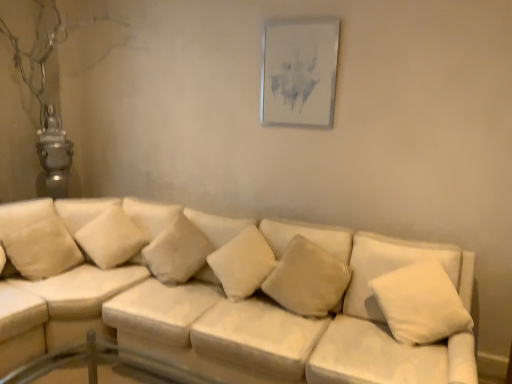
This screenshot has width=512, height=384. What are the coordinates of `white soft pillow at right, marked as the sixth pillow in a left-to-right arrangement` in the screenshot? It's located at (420, 303).

Describe the element at coordinates (37, 239) in the screenshot. The width and height of the screenshot is (512, 384). I see `white soft cushion at left, positioned as the first pillow in left-to-right order` at that location.

What do you see at coordinates (105, 366) in the screenshot?
I see `transparent glass table at lower left` at bounding box center [105, 366].

The image size is (512, 384). What do you see at coordinates (242, 263) in the screenshot?
I see `white soft cushion at center, which ranks as the fourth pillow in left-to-right order` at bounding box center [242, 263].

The width and height of the screenshot is (512, 384). Describe the element at coordinates (177, 251) in the screenshot. I see `white soft pillow at center, the fourth pillow in the right-to-left sequence` at that location.

The height and width of the screenshot is (384, 512). In order to click on soft beige pillow at center, the 5th pillow from the left in this screenshot , I will do `click(307, 278)`.

Considering the relative sizes of white soft cushion at center, the 3th pillow when ordered from right to left, and soft beige pillow at center, the second pillow viewed from the right, in the image provided, is white soft cushion at center, the 3th pillow when ordered from right to left, wider than soft beige pillow at center, the second pillow viewed from the right,?

Yes.

Considering their positions, is white soft cushion at center, which ranks as the fourth pillow in left-to-right order, located in front of or behind soft beige pillow at center, the 5th pillow from the left?

Visually, white soft cushion at center, which ranks as the fourth pillow in left-to-right order, is located behind soft beige pillow at center, the 5th pillow from the left.

Which object is positioned more to the left, white soft cushion at center, which ranks as the fourth pillow in left-to-right order, or soft beige pillow at center, the 5th pillow from the left?

white soft cushion at center, which ranks as the fourth pillow in left-to-right order.

From a real-world perspective, between white soft cushion at center, which ranks as the fourth pillow in left-to-right order, and soft beige pillow at center, the 5th pillow from the left, who is vertically lower?

soft beige pillow at center, the 5th pillow from the left, from a real-world perspective.

From a real-world perspective, is white soft pillow at right, marked as the sixth pillow in a left-to-right arrangement, beneath white fabric couch at center?

No, from a real-world perspective, white soft pillow at right, marked as the sixth pillow in a left-to-right arrangement, is not beneath white fabric couch at center.

Is white soft pillow at right, marked as the sixth pillow in a left-to-right arrangement, not near white fabric couch at center?

Actually, white soft pillow at right, marked as the sixth pillow in a left-to-right arrangement, and white fabric couch at center are a little close together.

Looking at their sizes, would you say white soft pillow at right, the 1th pillow from the right, is wider or thinner than white fabric couch at center?

Considering their sizes, white soft pillow at right, the 1th pillow from the right, looks slimmer than white fabric couch at center.

Is white soft pillow at right, marked as the sixth pillow in a left-to-right arrangement, to the left or to the right of white fabric couch at center in the image?

white soft pillow at right, marked as the sixth pillow in a left-to-right arrangement, is to the right of white fabric couch at center.

From the image's perspective, which is above, transparent glass table at lower left or white soft pillow at right, marked as the sixth pillow in a left-to-right arrangement?

white soft pillow at right, marked as the sixth pillow in a left-to-right arrangement, from the image's perspective.

Is transparent glass table at lower left facing away from white soft pillow at right, the 1th pillow from the right?

transparent glass table at lower left is not turned away from white soft pillow at right, the 1th pillow from the right.

Which is more to the right, transparent glass table at lower left or white soft pillow at right, the 1th pillow from the right?

Positioned to the right is white soft pillow at right, the 1th pillow from the right.

Consider the image. Is transparent glass table at lower left positioned behind white soft pillow at right, marked as the sixth pillow in a left-to-right arrangement?

No, the depth of transparent glass table at lower left is less than that of white soft pillow at right, marked as the sixth pillow in a left-to-right arrangement.

Is white soft cushion at left, which is the sixth pillow in right-to-left order, further to camera compared to soft beige pillow at center, the second pillow viewed from the right?

Yes, white soft cushion at left, which is the sixth pillow in right-to-left order, is further from the camera.

Looking at their sizes, would you say white soft cushion at left, positioned as the first pillow in left-to-right order, is wider or thinner than soft beige pillow at center, the 5th pillow from the left?

white soft cushion at left, positioned as the first pillow in left-to-right order, is wider than soft beige pillow at center, the 5th pillow from the left.

Considering the positions of objects white soft cushion at left, which is the sixth pillow in right-to-left order, and soft beige pillow at center, the 5th pillow from the left, in the image provided, who is more to the right, white soft cushion at left, which is the sixth pillow in right-to-left order, or soft beige pillow at center, the 5th pillow from the left,?

Positioned to the right is soft beige pillow at center, the 5th pillow from the left.

Between point (35, 211) and point (330, 298), which one is positioned in front?

Point (330, 298)

Is white soft pillow at upper left, positioned as the 2th pillow in left-to-right order, not near white fabric couch at center?

No, white soft pillow at upper left, positioned as the 2th pillow in left-to-right order, is not far from white fabric couch at center.

Is white fabric couch at center completely or partially inside white soft pillow at upper left, positioned as the 2th pillow in left-to-right order?

No, white fabric couch at center is not inside white soft pillow at upper left, positioned as the 2th pillow in left-to-right order.

Relative to white fabric couch at center, is white soft pillow at upper left, the 5th pillow positioned from the right, in front or behind?

white soft pillow at upper left, the 5th pillow positioned from the right, is positioned farther from the viewer than white fabric couch at center.

From the picture: Is white soft pillow at upper left, the 5th pillow positioned from the right, aimed at white fabric couch at center?

No, white soft pillow at upper left, the 5th pillow positioned from the right, is not turned towards white fabric couch at center.

Can you confirm if white soft pillow at center, the third pillow from the left, is bigger than white soft pillow at right, marked as the sixth pillow in a left-to-right arrangement?

Actually, white soft pillow at center, the third pillow from the left, might be smaller than white soft pillow at right, marked as the sixth pillow in a left-to-right arrangement.

Is point (187, 264) closer to camera compared to point (415, 322)?

That is False.

Relative to white soft pillow at right, the 1th pillow from the right, is white soft pillow at center, the third pillow from the left, in front or behind?

Visually, white soft pillow at center, the third pillow from the left, is located behind white soft pillow at right, the 1th pillow from the right.

Can you confirm if white soft pillow at center, the fourth pillow in the right-to-left sequence, is taller than white soft pillow at right, the 1th pillow from the right?

No.

Is white fabric couch at center outside of white soft pillow at upper left, the 5th pillow positioned from the right?

white fabric couch at center is positioned outside white soft pillow at upper left, the 5th pillow positioned from the right.

Considering the relative sizes of white fabric couch at center and white soft pillow at upper left, the 5th pillow positioned from the right, in the image provided, is white fabric couch at center taller than white soft pillow at upper left, the 5th pillow positioned from the right,?

Correct, white fabric couch at center is much taller as white soft pillow at upper left, the 5th pillow positioned from the right.

Does point (1, 304) appear closer or farther from the camera than point (92, 224)?

Clearly, point (1, 304) is closer to the camera than point (92, 224).

Can you tell me how much white fabric couch at center and white soft pillow at upper left, the 5th pillow positioned from the right, differ in facing direction?

white fabric couch at center and white soft pillow at upper left, the 5th pillow positioned from the right, are facing 24.2 degrees away from each other.

At what (x,y) coordinates should I click in order to perform the action: click on the 1st pillow positioned below the white soft cushion at center, the 3th pillow when ordered from right to left (from the image's perspective). Please return your answer as a coordinate pair (x, y). Looking at the image, I should click on (307, 278).

You are a GUI agent. You are given a task and a screenshot of the screen. Output one action in this format:
    pyautogui.click(x=<x>, y=<y>)
    Task: Click on the 1st pillow behind when counting from the white fabric couch at center
    This screenshot has height=384, width=512.
    Given the screenshot: What is the action you would take?
    pyautogui.click(x=420, y=303)

Which object lies nearer to the anchor point white fabric couch at center, white soft cushion at center, the 3th pillow when ordered from right to left, or transparent glass table at lower left?

white soft cushion at center, the 3th pillow when ordered from right to left, is positioned closer to the anchor white fabric couch at center.

Consider the image. Looking at the image, which one is located closer to transparent glass table at lower left, white soft pillow at center, the third pillow from the left, or white fabric couch at center?

white fabric couch at center lies closer to transparent glass table at lower left than the other object.

Looking at the image, which one is located further to white soft pillow at right, marked as the sixth pillow in a left-to-right arrangement, soft beige pillow at center, the 5th pillow from the left, or white soft cushion at center, the 3th pillow when ordered from right to left?

The object further to white soft pillow at right, marked as the sixth pillow in a left-to-right arrangement, is white soft cushion at center, the 3th pillow when ordered from right to left.

When comparing their distances from white soft pillow at right, the 1th pillow from the right, does white soft pillow at upper left, positioned as the 2th pillow in left-to-right order, or soft beige pillow at center, the second pillow viewed from the right, seem closer?

soft beige pillow at center, the second pillow viewed from the right, is closer to white soft pillow at right, the 1th pillow from the right.

When comparing their distances from white soft pillow at right, marked as the sixth pillow in a left-to-right arrangement, does soft beige pillow at center, the 5th pillow from the left, or metallic silver picture frame at upper center seem closer?

Result: The object closer to white soft pillow at right, marked as the sixth pillow in a left-to-right arrangement, is soft beige pillow at center, the 5th pillow from the left.

Looking at the image, which one is located further to transparent glass table at lower left, white soft pillow at center, the fourth pillow in the right-to-left sequence, or white soft cushion at center, the 3th pillow when ordered from right to left?

white soft cushion at center, the 3th pillow when ordered from right to left.

When comparing their distances from transparent glass table at lower left, does white soft pillow at right, the 1th pillow from the right, or white soft cushion at center, which ranks as the fourth pillow in left-to-right order, seem closer?

white soft cushion at center, which ranks as the fourth pillow in left-to-right order, is positioned closer to the anchor transparent glass table at lower left.

When comparing their distances from white soft pillow at right, the 1th pillow from the right, does white soft pillow at center, the third pillow from the left, or white soft cushion at center, which ranks as the fourth pillow in left-to-right order, seem further?

Among the two, white soft pillow at center, the third pillow from the left, is located further to white soft pillow at right, the 1th pillow from the right.

This screenshot has width=512, height=384. Find the location of `studio couch located between transparent glass table at lower left and white soft cushion at center, the 3th pillow when ordered from right to left, in the depth direction`. studio couch located between transparent glass table at lower left and white soft cushion at center, the 3th pillow when ordered from right to left, in the depth direction is located at coordinates (228, 296).

The image size is (512, 384). What are the coordinates of `studio couch positioned between transparent glass table at lower left and soft beige pillow at center, the 5th pillow from the left, from near to far` in the screenshot? It's located at (228, 296).

Locate an element on the screen. This screenshot has width=512, height=384. pillow located between white soft pillow at center, the third pillow from the left, and soft beige pillow at center, the second pillow viewed from the right, in the left-right direction is located at coordinates (242, 263).

I want to click on studio couch located between white soft cushion at left, which is the sixth pillow in right-to-left order, and metallic silver picture frame at upper center in the left-right direction, so click(228, 296).